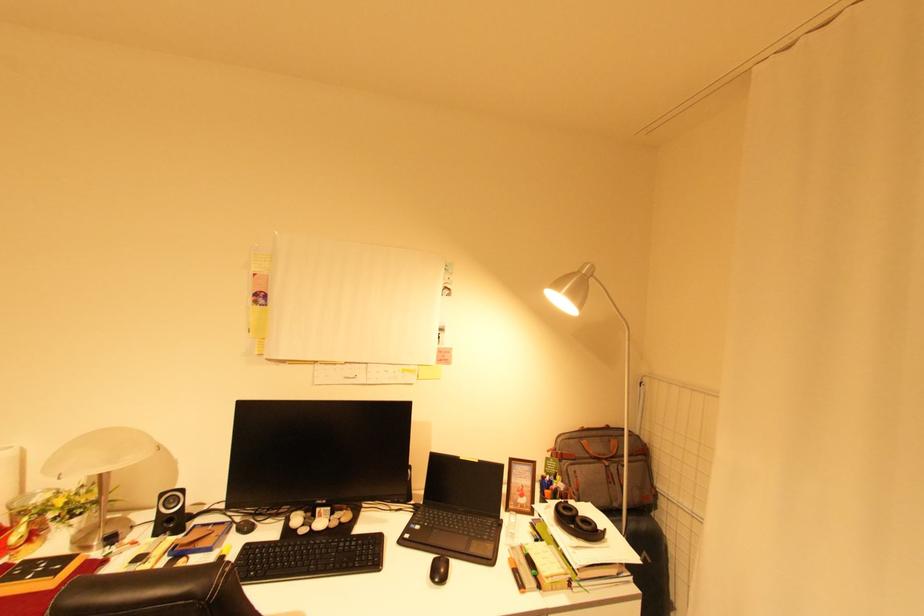
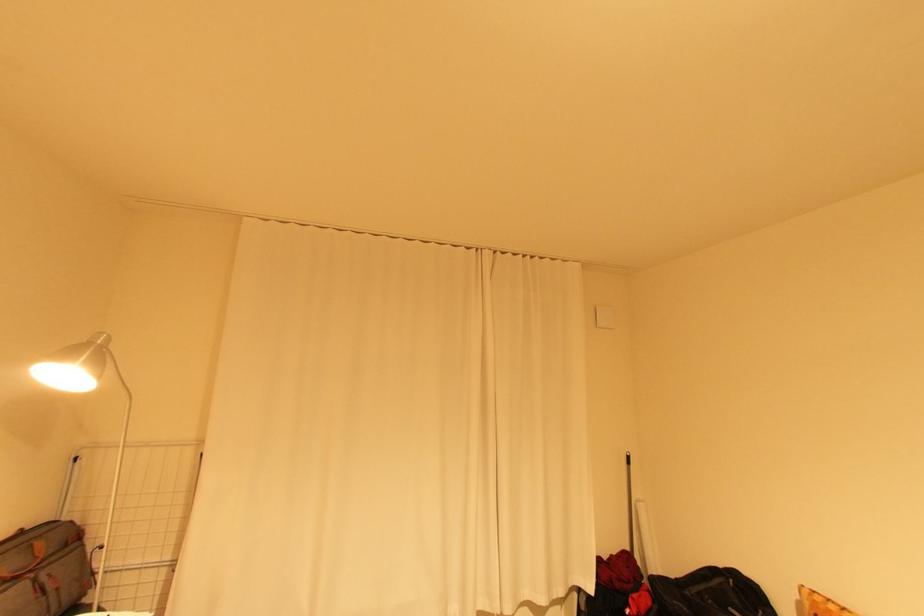
Question: The camera is either moving clockwise (left) or counter-clockwise (right) around the object. The first image is from the beginning of the video and the second image is from the end. Is the camera moving left or right when shooting the video?

Choices:
 (A) Left
 (B) Right

Answer: (A)